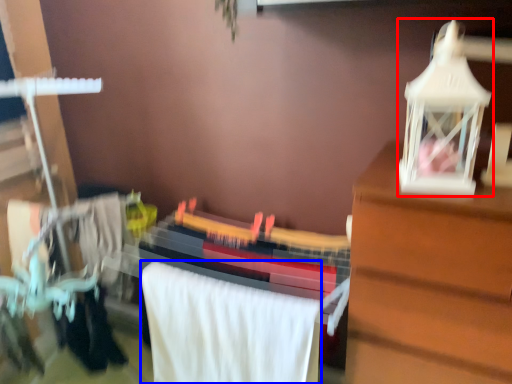
Question: Among these objects, which one is nearest to the camera, toy (highlighted by a red box) or bath towel (highlighted by a blue box)?

Choices:
 (A) toy
 (B) bath towel

Answer: (A)